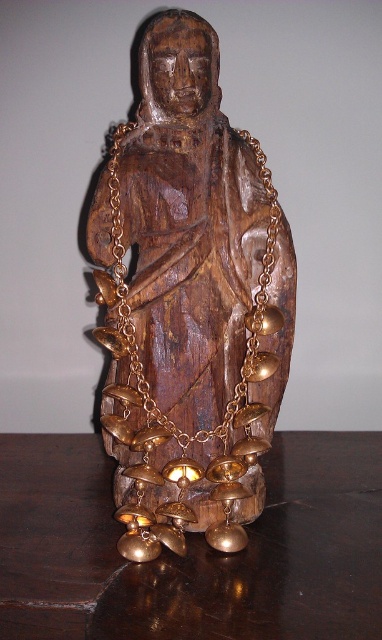
The width and height of the screenshot is (382, 640). Describe the element at coordinates (189, 301) in the screenshot. I see `wooden statue at center` at that location.

Based on the photo, between wooden statue at center and shiny dark wood table at center, which one has less height?

With less height is shiny dark wood table at center.

Which is in front, point (168, 385) or point (58, 552)?

Point (58, 552) is more forward.

The height and width of the screenshot is (640, 382). In order to click on wooden statue at center in this screenshot , I will do `click(189, 301)`.